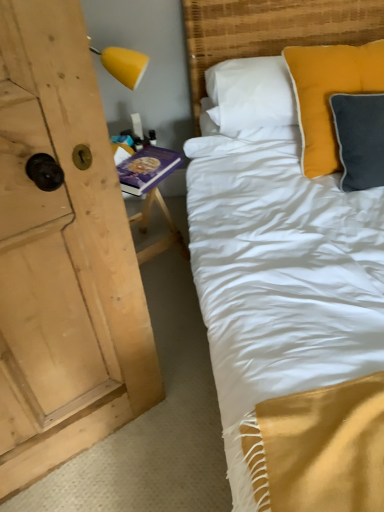
Question: In terms of size, does matte yellow pillow at upper right appear bigger or smaller than woven bamboo headboard at upper right?

Choices:
 (A) big
 (B) small

Answer: (B)

Question: Relative to woven bamboo headboard at upper right, is matte yellow pillow at upper right in front or behind?

Choices:
 (A) behind
 (B) front

Answer: (B)

Question: Which is nearer to the woven bamboo headboard at upper right?

Choices:
 (A) purple hardcover book at left
 (B) matte yellow pillow at upper right

Answer: (B)

Question: Considering the real-world distances, which object is closest to the woven bamboo headboard at upper right?

Choices:
 (A) purple hardcover book at left
 (B) matte yellow pillow at upper right

Answer: (B)